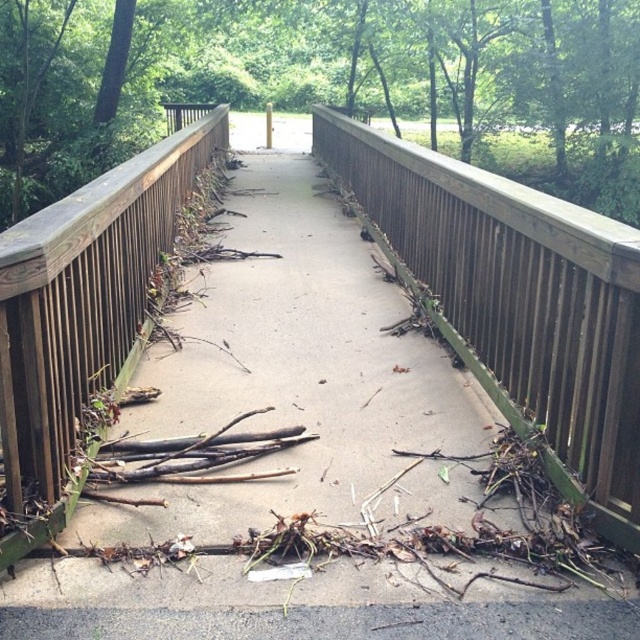
You are standing on the pedestrian bridge and want to walk from point (426, 163) to point (0, 305). Which direction should you move to get closer to your destination?

You should move downward because point (426, 163) is further to the viewer than point (0, 305), so moving downward will bring you closer to the destination.

You are a maintenance worker inspecting the brown wooden rail at center and the brown wooden balustrade at left. Which one requires more material to replace the top beam if they both need to be replaced?

The brown wooden balustrade at left requires more material to replace the top beam because it is taller than the brown wooden rail at center.

You are standing on the pedestrian bridge and want to take a photo of the brown wooden rail at center. If your camera can focus on objects up to 15 feet away, will it be able to capture the rail clearly?

The brown wooden rail at center is 14.84 feet away from the camera, which is within the camera focus range of up to 15 feet. Therefore, the camera can capture the rail clearly.